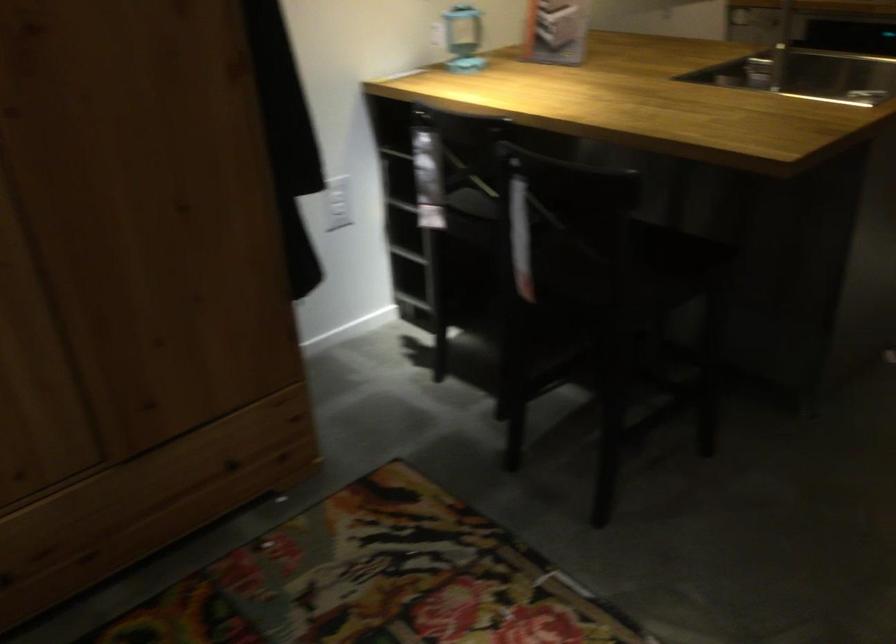
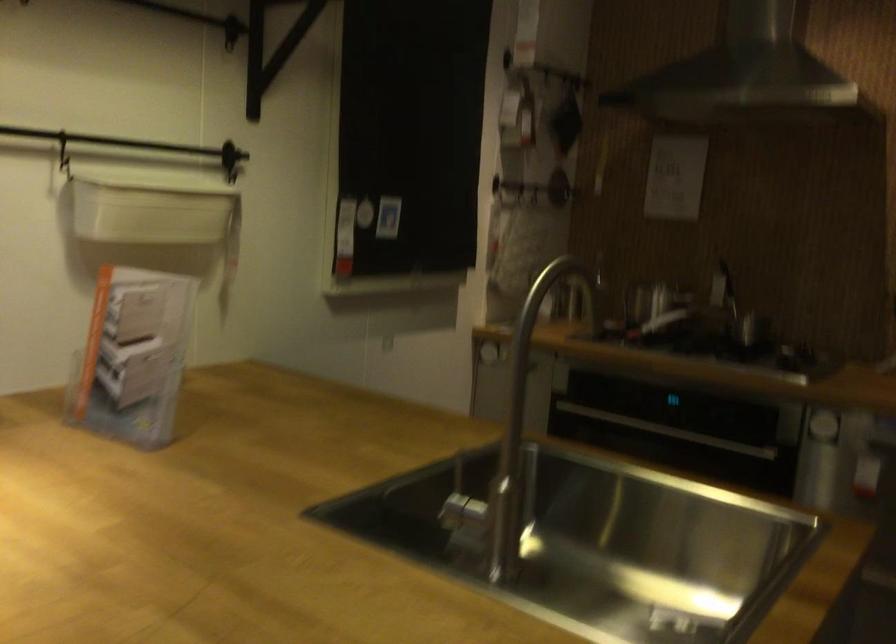
What movement of the cameraman would produce the second image?

The movement direction of the cameraman is right, forward.